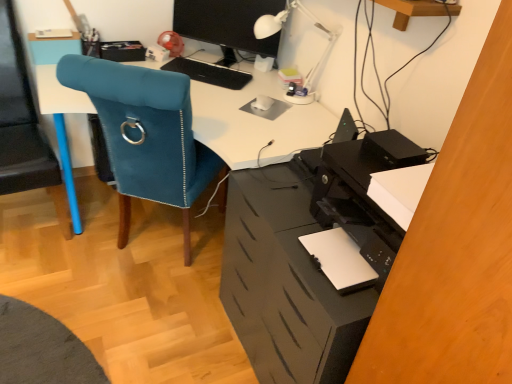
What are the coordinates of `free location above black matte file cabinet at lower right (from a real-world perspective)` in the screenshot? It's located at (283, 191).